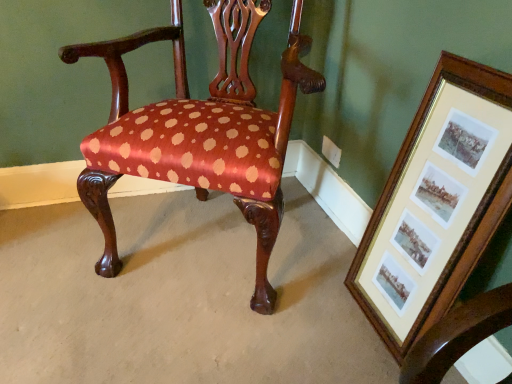
Question: Is satin-polka dot chair at center to the left of wooden framed prints at right from the viewer's perspective?

Choices:
 (A) yes
 (B) no

Answer: (A)

Question: Considering the relative sizes of satin-polka dot chair at center and wooden framed prints at right in the image provided, is satin-polka dot chair at center taller than wooden framed prints at right?

Choices:
 (A) yes
 (B) no

Answer: (A)

Question: Is satin-polka dot chair at center positioned far away from wooden framed prints at right?

Choices:
 (A) yes
 (B) no

Answer: (B)

Question: Is satin-polka dot chair at center facing towards wooden framed prints at right?

Choices:
 (A) no
 (B) yes

Answer: (A)

Question: From the image's perspective, is satin-polka dot chair at center beneath wooden framed prints at right?

Choices:
 (A) no
 (B) yes

Answer: (A)

Question: Is satin-polka dot chair at center not inside wooden framed prints at right?

Choices:
 (A) yes
 (B) no

Answer: (A)

Question: Is wooden framed prints at right shorter than satin-polka dot chair at center?

Choices:
 (A) no
 (B) yes

Answer: (B)

Question: Is wooden framed prints at right outside of satin-polka dot chair at center?

Choices:
 (A) no
 (B) yes

Answer: (B)

Question: Considering the relative sizes of wooden framed prints at right and satin-polka dot chair at center in the image provided, is wooden framed prints at right thinner than satin-polka dot chair at center?

Choices:
 (A) yes
 (B) no

Answer: (A)

Question: Can you confirm if wooden framed prints at right is positioned to the left of satin-polka dot chair at center?

Choices:
 (A) no
 (B) yes

Answer: (A)

Question: From a real-world perspective, does wooden framed prints at right stand above satin-polka dot chair at center?

Choices:
 (A) yes
 (B) no

Answer: (B)

Question: Is the position of wooden framed prints at right more distant than that of satin-polka dot chair at center?

Choices:
 (A) yes
 (B) no

Answer: (B)

Question: In terms of size, does satin-polka dot chair at center appear bigger or smaller than wooden framed prints at right?

Choices:
 (A) big
 (B) small

Answer: (A)